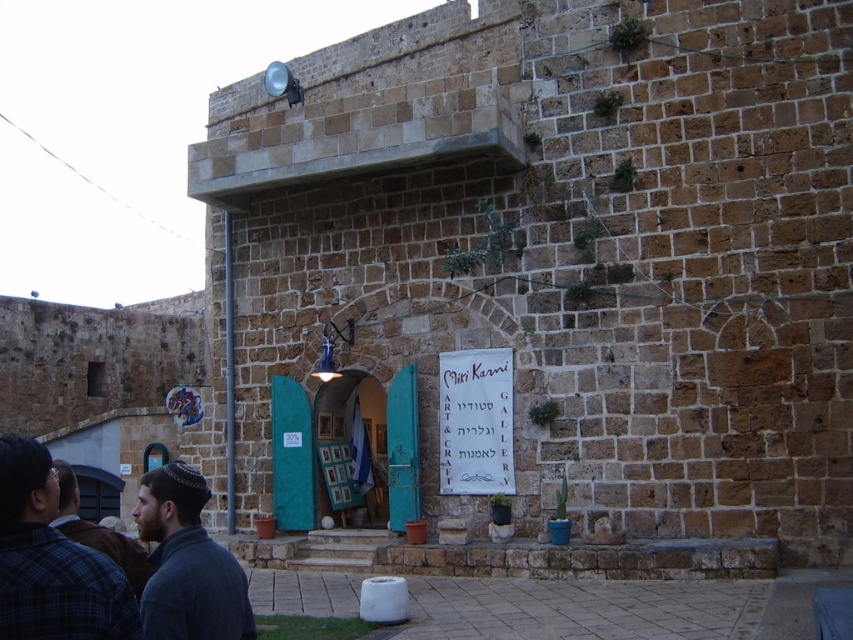
Question: Which object appears farthest from the camera in this image?

Choices:
 (A) dark gray knit sweater at lower left
 (B) wooden framed pictures at center

Answer: (B)

Question: Can you confirm if dark gray knit sweater at lower left is thinner than wooden framed pictures at center?

Choices:
 (A) yes
 (B) no

Answer: (B)

Question: Does white paper banner at center appear under wooden framed pictures at center?

Choices:
 (A) no
 (B) yes

Answer: (A)

Question: Observing the image, what is the correct spatial positioning of gray wool sweater at lower left in reference to wooden framed pictures at center?

Choices:
 (A) left
 (B) right

Answer: (A)

Question: Among these objects, which one is farthest from the camera?

Choices:
 (A) gray wool sweater at lower left
 (B) dark gray knit sweater at lower left
 (C) white paper banner at center

Answer: (C)

Question: Which point is closer to the camera?

Choices:
 (A) (70, 538)
 (B) (119, 624)
 (C) (502, 381)
 (D) (167, 540)

Answer: (B)